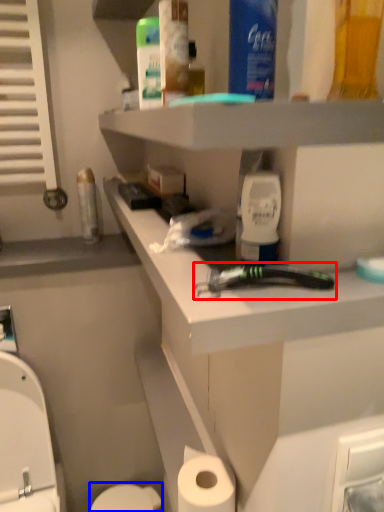
Question: Which point is further to the camera, tool (highlighted by a red box) or toilet bowl (highlighted by a blue box)?

Choices:
 (A) tool
 (B) toilet bowl

Answer: (B)